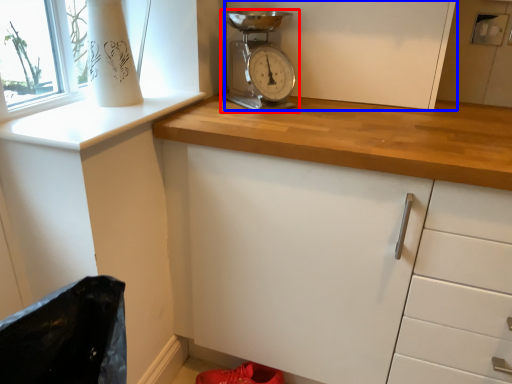
Question: Which object is further to the camera taking this photo, home appliance (highlighted by a red box) or cabinetry (highlighted by a blue box)?

Choices:
 (A) home appliance
 (B) cabinetry

Answer: (B)